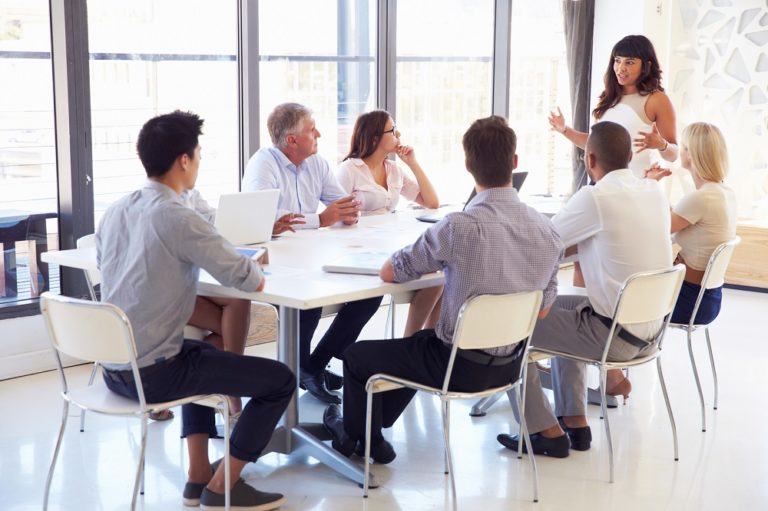
Identify the location of windows. This screenshot has height=511, width=768. (51, 131), (48, 22), (150, 105), (138, 38), (313, 105), (300, 35), (434, 92), (429, 9), (564, 105), (541, 25).